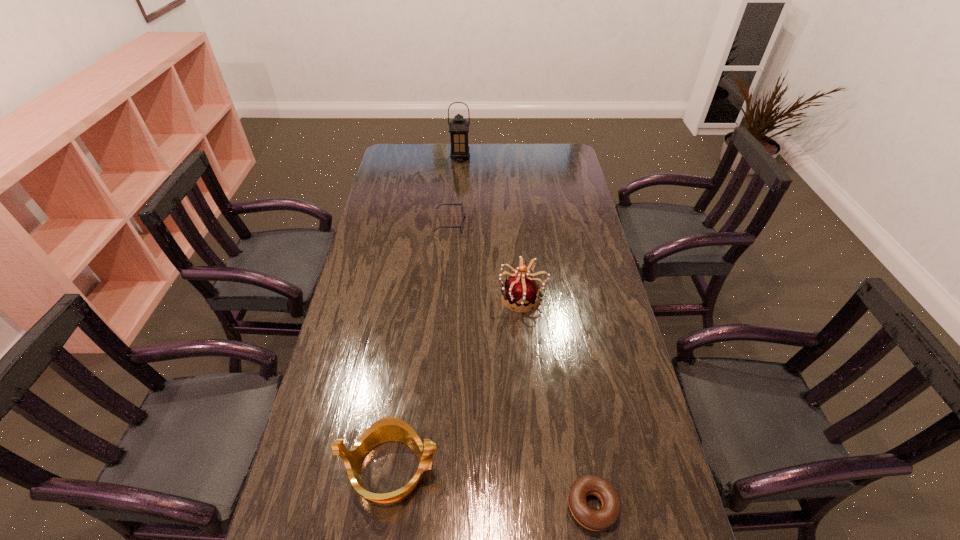
Locate an element on the screen. The image size is (960, 540). lantern is located at coordinates (458, 128).

Identify the location of the farthest object. (458, 128).

This screenshot has height=540, width=960. What are the coordinates of `the taller tiara` in the screenshot? It's located at click(521, 289).

Identify the location of the second tallest object. (521, 289).

Image resolution: width=960 pixels, height=540 pixels. I want to click on the third shortest object, so click(386, 429).

This screenshot has height=540, width=960. In order to click on the shorter tiara in this screenshot , I will do (x=386, y=429).

Where is `spectacles`? spectacles is located at coordinates (463, 215).

This screenshot has width=960, height=540. In order to click on doughnut in this screenshot , I will do `click(596, 520)`.

This screenshot has width=960, height=540. What are the coordinates of `vacant space located on the back of the farthest object` in the screenshot? It's located at (461, 145).

This screenshot has width=960, height=540. Find the location of `vacant space located 0.080m on the front-facing side of the third farthest object`. vacant space located 0.080m on the front-facing side of the third farthest object is located at coordinates (474, 297).